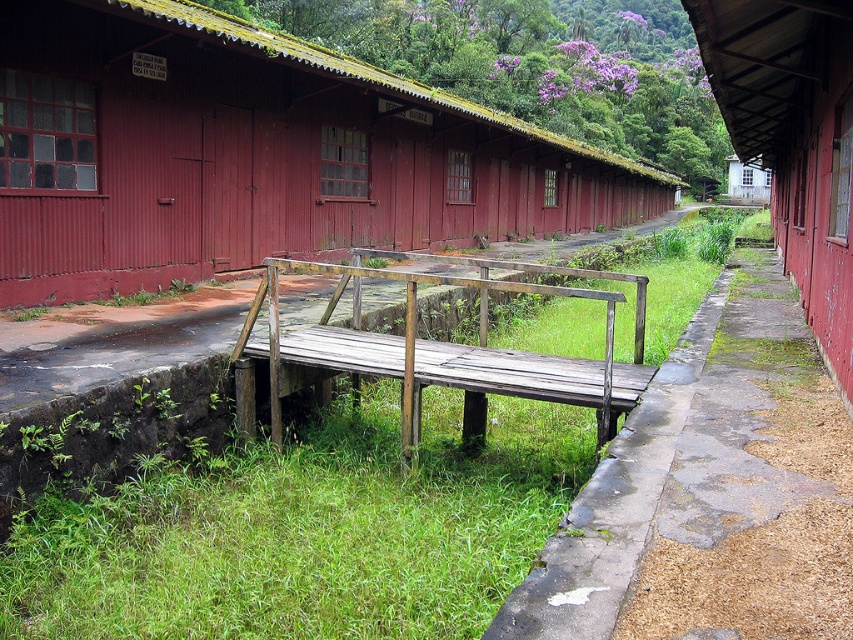
Question: Is rustic wood hut at center to the left of rusty metal hut at right from the viewer's perspective?

Choices:
 (A) no
 (B) yes

Answer: (B)

Question: Which point is farther to the camera?

Choices:
 (A) white wood hut at upper right
 (B) weathered wood rail at center
 (C) rustic wood hut at center
 (D) rusty metal hut at right

Answer: (A)

Question: Which object appears closest to the camera in this image?

Choices:
 (A) rustic wood hut at center
 (B) rusty metal hut at right
 (C) weathered wood rail at center

Answer: (C)

Question: Which object is the closest to the weathered wood rail at center?

Choices:
 (A) white wood hut at upper right
 (B) green grass at center
 (C) rusty metal hut at right
 (D) rustic wood hut at center

Answer: (B)

Question: Does green grass at center have a smaller size compared to white wood hut at upper right?

Choices:
 (A) yes
 (B) no

Answer: (A)

Question: Is green grass at center wider than weathered wood rail at center?

Choices:
 (A) no
 (B) yes

Answer: (B)